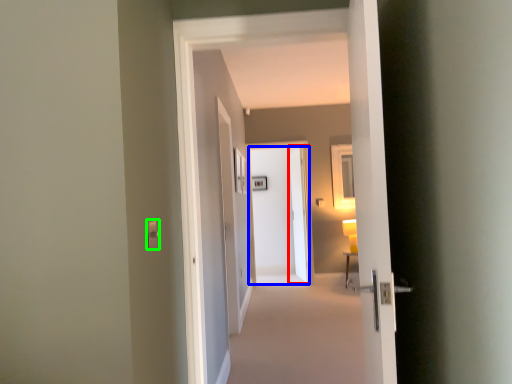
Question: Considering the real-world distances, which object is closest to screen door (highlighted by a red box)? door (highlighted by a blue box) or light switch (highlighted by a green box).

Choices:
 (A) door
 (B) light switch

Answer: (A)